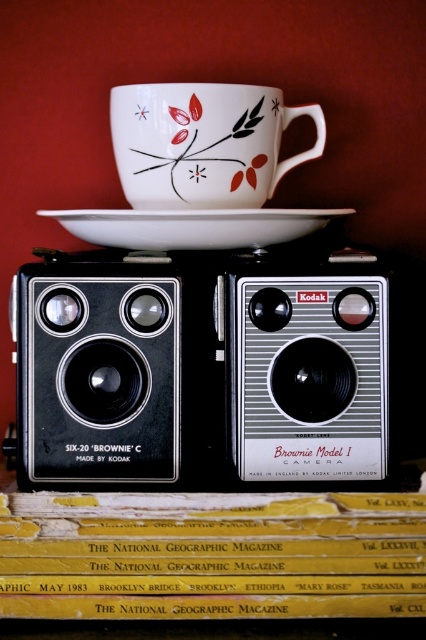
Is black plastic kodak camera at center closer to the viewer compared to porcelain cup with floral design at upper center?

Yes.

Is point (377, 449) positioned before point (278, 108)?

Yes, point (377, 449) is in front of point (278, 108).

Locate an element on the screen. black plastic kodak camera at center is located at coordinates (201, 369).

You are a GUI agent. You are given a task and a screenshot of the screen. Output one action in this format:
    pyautogui.click(x=<x>, y=<y>)
    Task: Click on the black plastic kodak camera at center
    The image size is (426, 640).
    Given the screenshot: What is the action you would take?
    pyautogui.click(x=201, y=369)

Is yellow paper book at lower center above porcelain cup with floral design at upper center?

Actually, yellow paper book at lower center is below porcelain cup with floral design at upper center.

Between yellow paper book at lower center and porcelain cup with floral design at upper center, which one has more height?

porcelain cup with floral design at upper center

The width and height of the screenshot is (426, 640). What are the coordinates of `yellow paper book at lower center` in the screenshot? It's located at (212, 556).

Does black plastic kodak camera at center appear over white glossy saucer at center?

No.

Between point (345, 252) and point (118, 214), which one is positioned behind?

The point (345, 252) is more distant.

Image resolution: width=426 pixels, height=640 pixels. I want to click on black plastic kodak camera at center, so click(x=201, y=369).